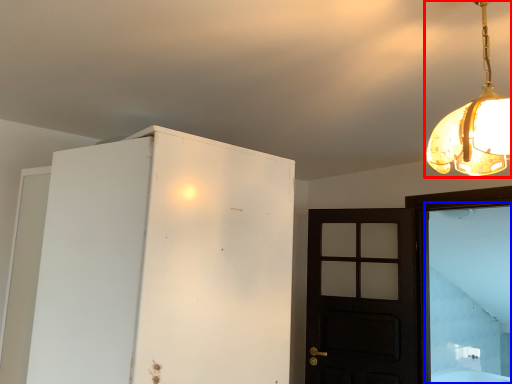
Question: Among these objects, which one is nearest to the camera, lamp (highlighted by a red box) or window (highlighted by a blue box)?

Choices:
 (A) lamp
 (B) window

Answer: (A)